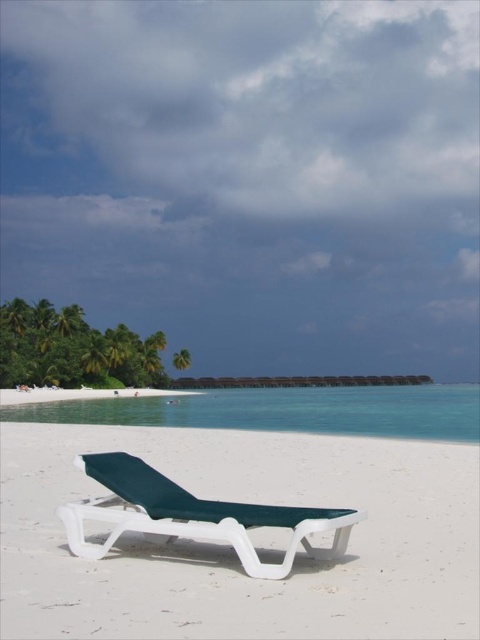
Does white plastic beach chair at center appear on the left side of white sand beach at lower left?

No, white plastic beach chair at center is not to the left of white sand beach at lower left.

Is white plastic beach chair at center positioned behind white sand beach at lower left?

No, it is not.

Image resolution: width=480 pixels, height=640 pixels. Describe the element at coordinates (192, 515) in the screenshot. I see `white plastic beach chair at center` at that location.

Where is `white plastic beach chair at center`? The image size is (480, 640). white plastic beach chair at center is located at coordinates (192, 515).

From the picture: Between white sand at center and white sand beach at lower left, which one has more height?

With more height is white sand beach at lower left.

Where is `white sand at center`? The image size is (480, 640). white sand at center is located at coordinates (231, 550).

Find the location of `white sand at center`. white sand at center is located at coordinates (231, 550).

Is white sand at center thinner than white plastic beach chair at center?

In fact, white sand at center might be wider than white plastic beach chair at center.

Is white sand at center smaller than white plastic beach chair at center?

No.

Does point (192, 435) lie in front of point (144, 467)?

That is False.

Locate an element on the screen. white sand at center is located at coordinates (231, 550).